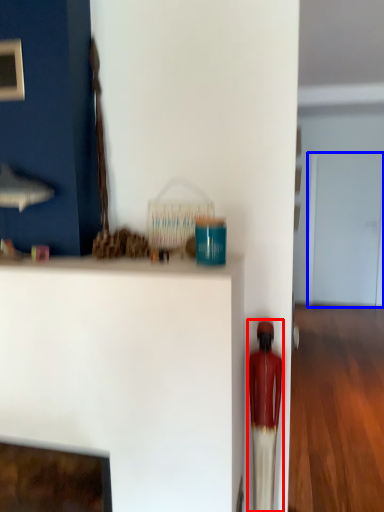
Question: Which object is closer to the camera taking this photo, toy (highlighted by a red box) or glass door (highlighted by a blue box)?

Choices:
 (A) toy
 (B) glass door

Answer: (A)